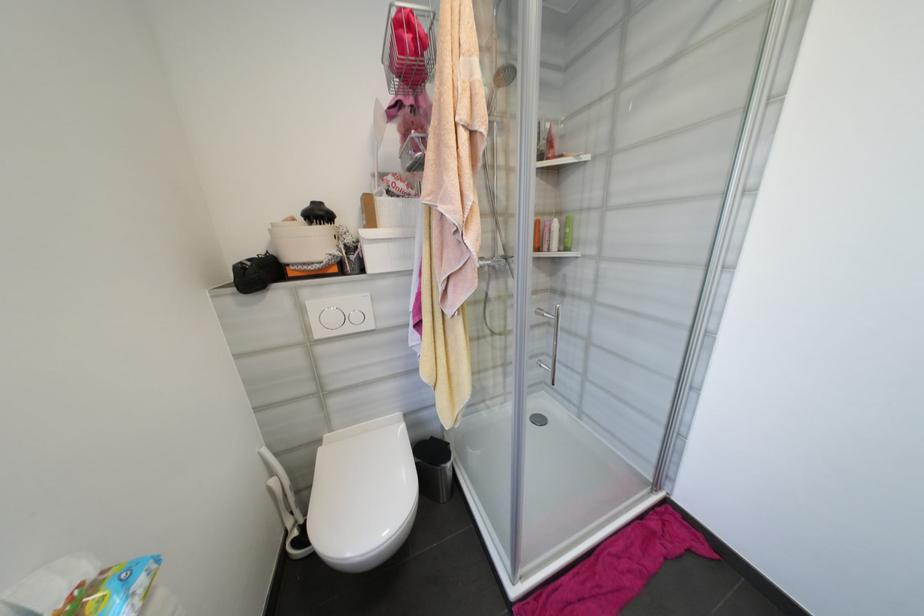
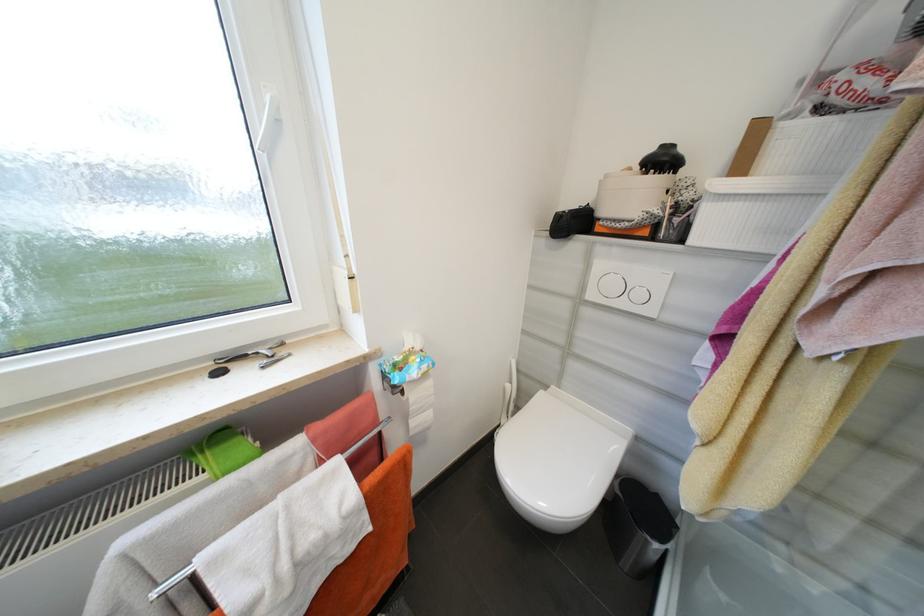
Locate, in the second image, the point that corresponds to point (369, 272) in the first image.

(687, 241)